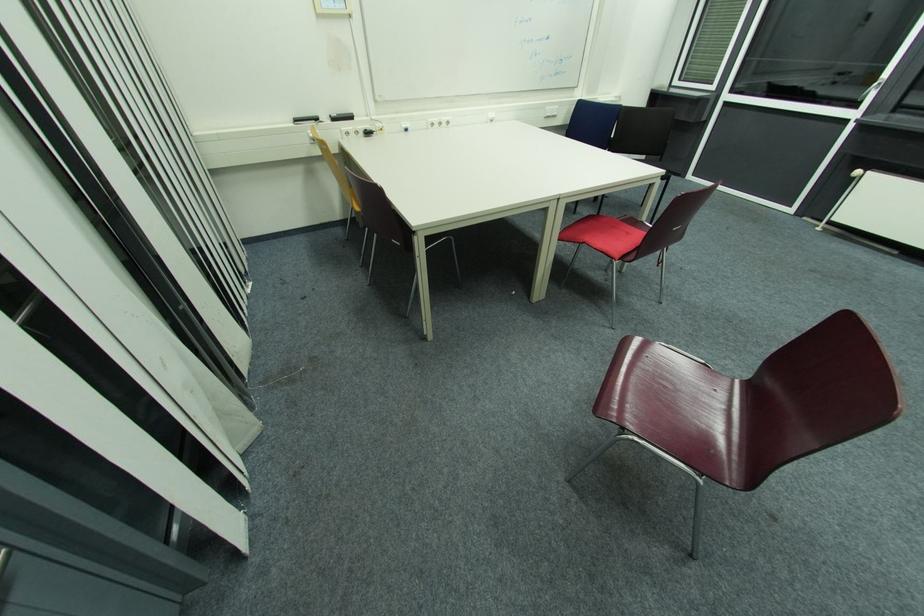
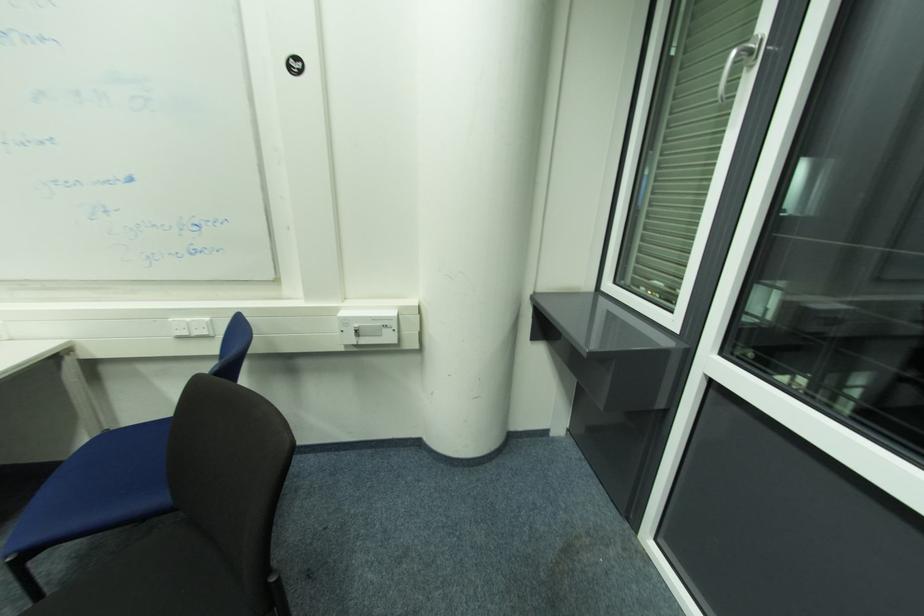
Find the pixel in the second image that matches [615,102] in the first image.

(378, 320)